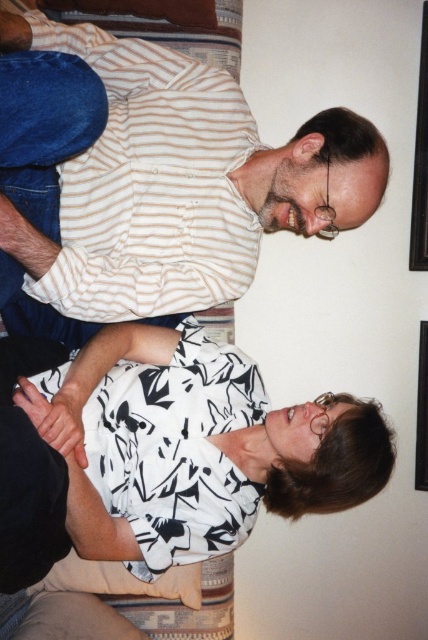
You are trying to decide whether to place a new decorative pillow on the white printed blouse at lower center or the velvet blue bed at upper left. Based on their widths, which object can accommodate a wider pillow?

The white printed blouse at lower center might be wider than velvet blue bed at upper left, so it can accommodate a wider pillow.

You are standing at the point labeled point (x=332, y=202) and want to move to the person on the left. Given that you can only move in straight lines and your maximum reach is 3 feet, can you reach them without moving?

The distance between you and the person on the left is 3.60 feet, which exceeds your maximum reach of 3 feet. Therefore, you cannot reach them without moving.